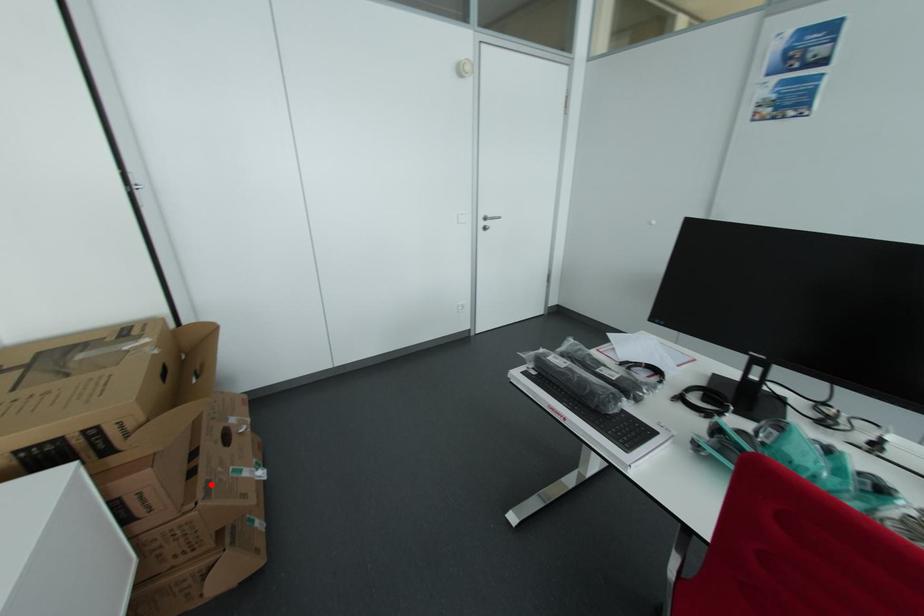
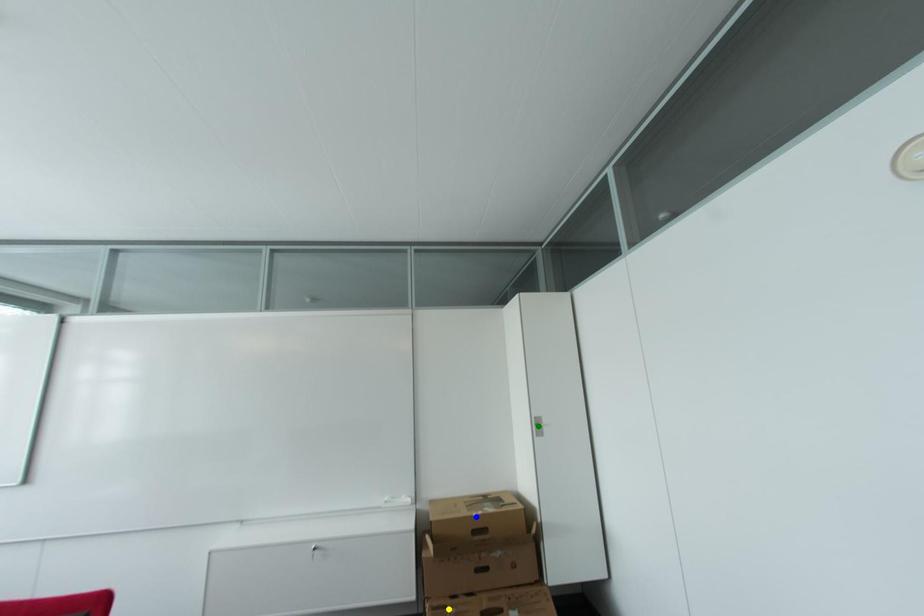
Question: I am providing you with two images of the same scene from different viewpoints. A red point is marked on the first image. You are given multiple points on the second image. Which point in image 2 represents the same 3d spot as the red point in image 1?

Choices:
 (A) yellow point
 (B) blue point
 (C) green point

Answer: (A)